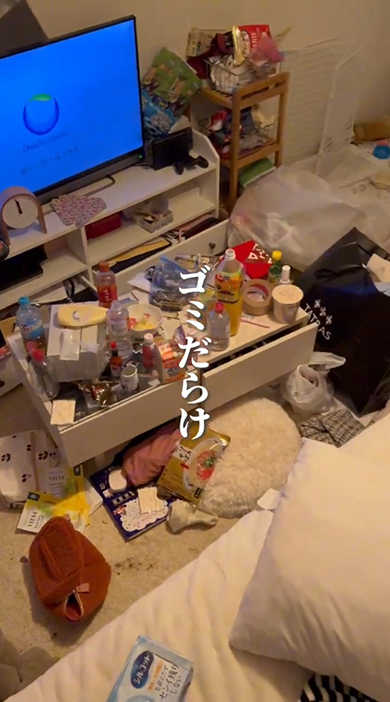
The height and width of the screenshot is (702, 390). I want to click on computer, so click(76, 121).